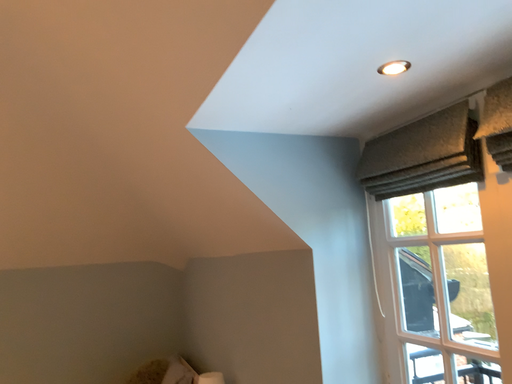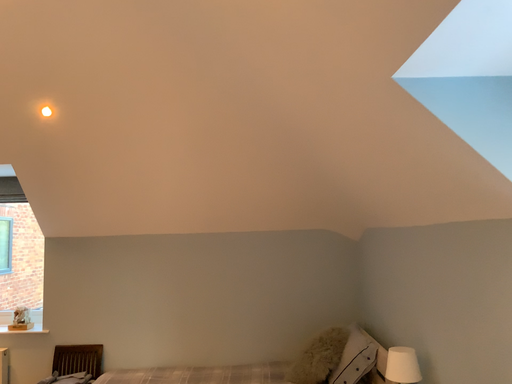
Question: Which way did the camera rotate in the video?

Choices:
 (A) rotated right
 (B) rotated left

Answer: (B)